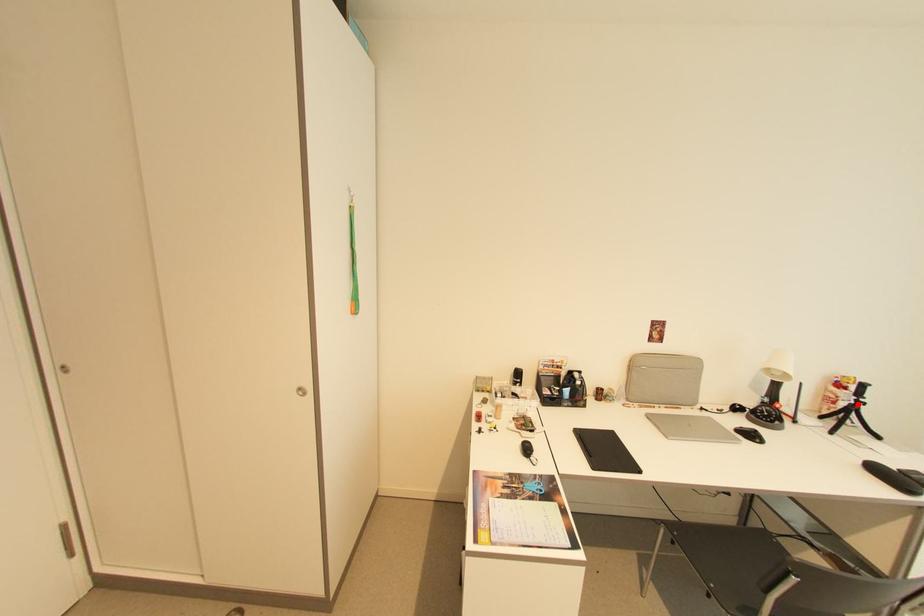
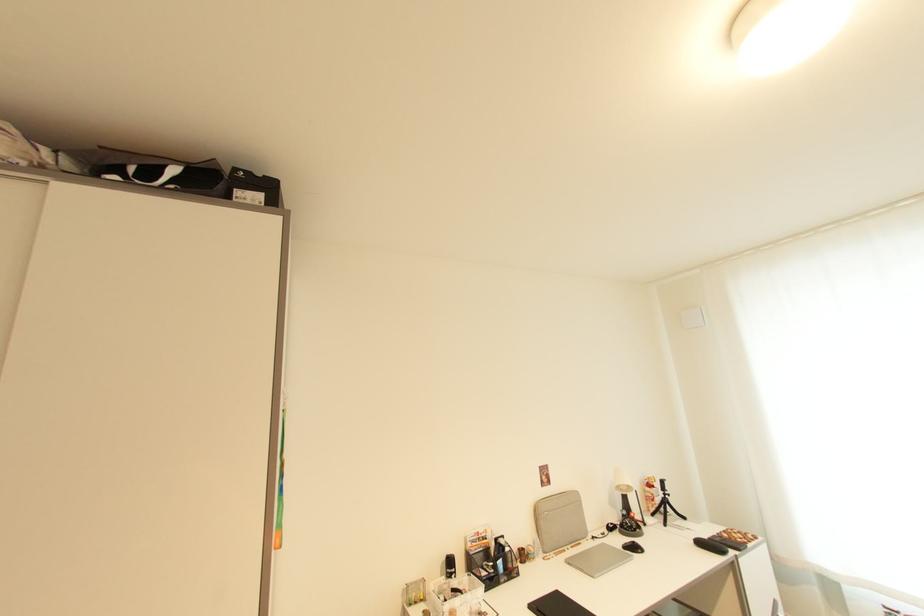
Locate, in the second image, the point that corresponds to the highlighted location in the first image.

(669, 498)